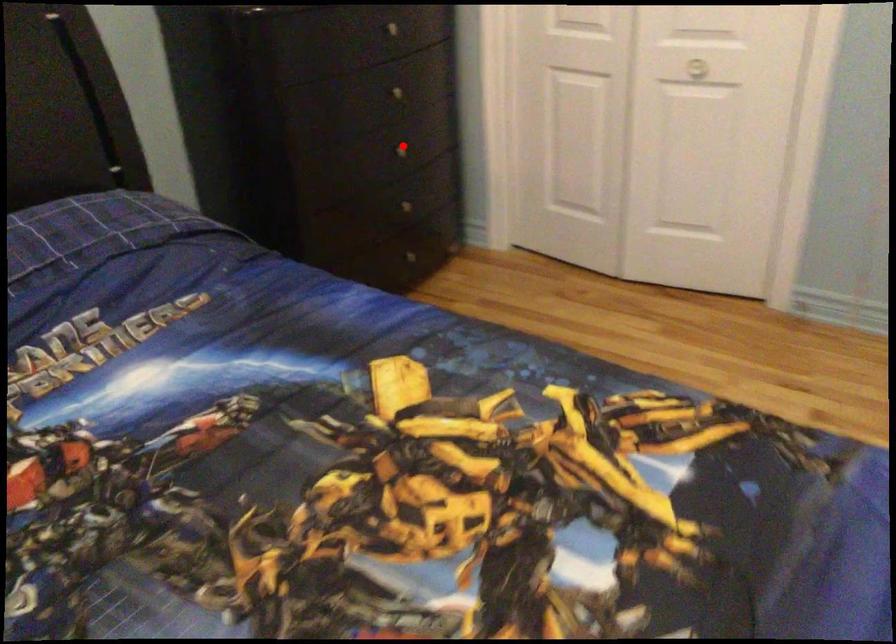
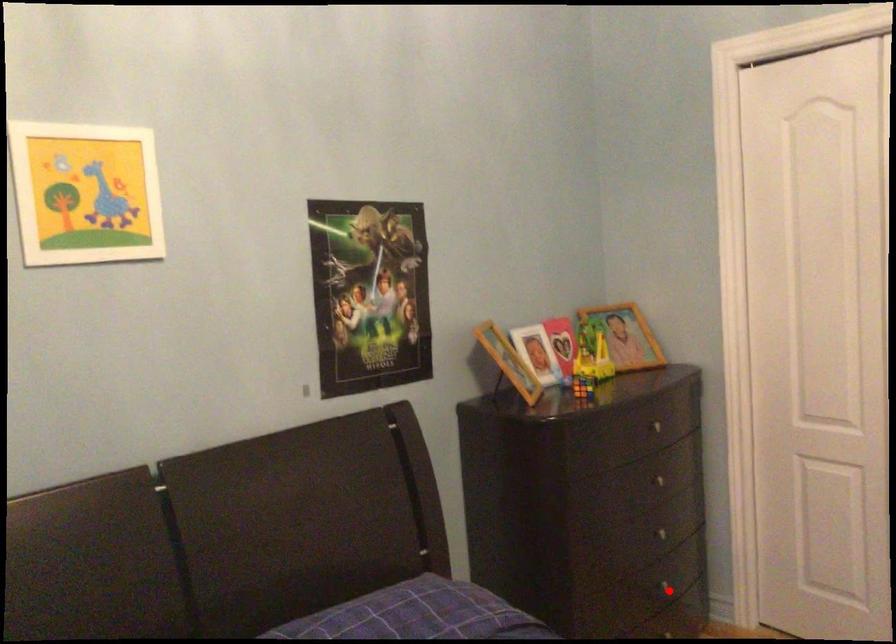
I am providing you with two images of the same scene from different viewpoints. A red point is marked on the first image and another point is marked on the second image. Does the point marked in image1 correspond to the same location as the one in image2?

No